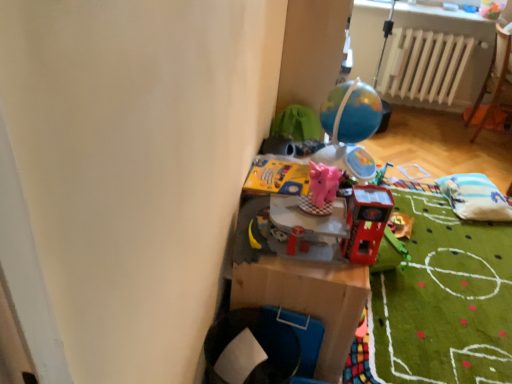
Identify the location of shiny metallic globe at upper center, the 4th toy positioned from the front. This screenshot has height=384, width=512. (350, 128).

The image size is (512, 384). Describe the element at coordinates (475, 197) in the screenshot. I see `white fabric bean bag at right` at that location.

What is the approximate width of white fabric bean bag at right?

It is 14.12 inches.

In order to face pink rubber elephant at center, the 3th toy in the back-to-front sequence, should I rotate leftwards or rightwards?

It's best to rotate right around 8.868 degrees.

The height and width of the screenshot is (384, 512). I want to click on wooden chair at right, so click(495, 81).

The width and height of the screenshot is (512, 384). What do you see at coordinates (366, 222) in the screenshot? I see `metallic red dartboard at center, the 4th toy positioned from the back` at bounding box center [366, 222].

Locate an element on the screen. shiny metallic globe at upper center, arranged as the first toy when viewed from the back is located at coordinates (350, 128).

Which is more to the right, shiny metallic globe at upper center, the 4th toy positioned from the front, or white matte radiator at upper right?

white matte radiator at upper right.

Considering the relative sizes of shiny metallic globe at upper center, the 4th toy positioned from the front, and white matte radiator at upper right in the image provided, is shiny metallic globe at upper center, the 4th toy positioned from the front, bigger than white matte radiator at upper right?

No, shiny metallic globe at upper center, the 4th toy positioned from the front, is not bigger than white matte radiator at upper right.

Is white matte radiator at upper right inside shiny metallic globe at upper center, the 4th toy positioned from the front?

No, white matte radiator at upper right is not inside shiny metallic globe at upper center, the 4th toy positioned from the front.

Considering the relative sizes of white matte radiator at upper right and shiny metallic globe at upper center, the 4th toy positioned from the front, in the image provided, is white matte radiator at upper right shorter than shiny metallic globe at upper center, the 4th toy positioned from the front,?

No, white matte radiator at upper right is not shorter than shiny metallic globe at upper center, the 4th toy positioned from the front.

From the image's perspective, which one is positioned lower, white matte radiator at upper right or shiny metallic globe at upper center, the 4th toy positioned from the front?

shiny metallic globe at upper center, the 4th toy positioned from the front, appears lower in the image.

Which is closer to the camera, (x=443, y=62) or (x=338, y=119)?

Point (x=443, y=62) is positioned farther from the camera compared to point (x=338, y=119).

From a real-world perspective, who is located higher, white matte radiator at upper right or shiny metallic globe at upper center, the 4th toy positioned from the front?

From a 3D spatial view, shiny metallic globe at upper center, the 4th toy positioned from the front, is above.

Between shiny metallic globe at upper center, the 4th toy positioned from the front, and metallic red dartboard at center, the 4th toy positioned from the back, which one appears on the right side from the viewer's perspective?

shiny metallic globe at upper center, the 4th toy positioned from the front.

Does shiny metallic globe at upper center, the 4th toy positioned from the front, lie behind metallic red dartboard at center, the 1th toy when ordered from front to back?

Yes, shiny metallic globe at upper center, the 4th toy positioned from the front, is behind metallic red dartboard at center, the 1th toy when ordered from front to back.

Which of these two, shiny metallic globe at upper center, the 4th toy positioned from the front, or metallic red dartboard at center, the 4th toy positioned from the back, is wider?

Wider between the two is shiny metallic globe at upper center, the 4th toy positioned from the front.

Can you see shiny metallic globe at upper center, arranged as the first toy when viewed from the back, touching metallic red dartboard at center, the 1th toy when ordered from front to back?

No, shiny metallic globe at upper center, arranged as the first toy when viewed from the back, is not making contact with metallic red dartboard at center, the 1th toy when ordered from front to back.

Which is less distant, (457, 213) or (359, 160)?

Clearly, point (457, 213) is more distant from the camera than point (359, 160).

Based on the photo, from a real-world perspective, which is physically above, white fabric bean bag at right or shiny metallic globe at upper center, arranged as the first toy when viewed from the back?

In real-world perspective, shiny metallic globe at upper center, arranged as the first toy when viewed from the back, is above.

Which object is closer to the camera taking this photo, white fabric bean bag at right or shiny metallic globe at upper center, arranged as the first toy when viewed from the back?

shiny metallic globe at upper center, arranged as the first toy when viewed from the back, is more forward.

Consider the image. Are white fabric bean bag at right and shiny metallic globe at upper center, the 4th toy positioned from the front, making contact?

They are not placed beside each other.

How distant is wooden chair at right from white fabric bean bag at right?

The distance of wooden chair at right from white fabric bean bag at right is 3.34 feet.

Would you say wooden chair at right is a long distance from white fabric bean bag at right?

Indeed, wooden chair at right is not near white fabric bean bag at right.

In the scene shown: Can we say wooden chair at right lies outside white fabric bean bag at right?

Yes, wooden chair at right is outside of white fabric bean bag at right.

This screenshot has width=512, height=384. I want to click on furniture above the white fabric bean bag at right (from a real-world perspective), so click(x=495, y=81).

How far apart are yellow cardboard book at center, marked as the 3th toy in a front-to-back arrangement, and metallic red dartboard at center, the 4th toy positioned from the back?

The distance of yellow cardboard book at center, marked as the 3th toy in a front-to-back arrangement, from metallic red dartboard at center, the 4th toy positioned from the back, is 12.97 inches.

Is yellow cardboard book at center, marked as the 3th toy in a front-to-back arrangement, bigger or smaller than metallic red dartboard at center, the 1th toy when ordered from front to back?

In the image, yellow cardboard book at center, marked as the 3th toy in a front-to-back arrangement, appears to be smaller than metallic red dartboard at center, the 1th toy when ordered from front to back.

Could you tell me if yellow cardboard book at center, positioned as the 2th toy in back-to-front order, is turned towards metallic red dartboard at center, the 4th toy positioned from the back?

No, yellow cardboard book at center, positioned as the 2th toy in back-to-front order, is not turned towards metallic red dartboard at center, the 4th toy positioned from the back.

Can you tell me how much yellow cardboard book at center, marked as the 3th toy in a front-to-back arrangement, and metallic red dartboard at center, the 1th toy when ordered from front to back, differ in facing direction?

The angle between the facing direction of yellow cardboard book at center, marked as the 3th toy in a front-to-back arrangement, and the facing direction of metallic red dartboard at center, the 1th toy when ordered from front to back, is 9.46 degrees.

Would you consider metallic red dartboard at center, the 1th toy when ordered from front to back, to be distant from white fabric bean bag at right?

Absolutely, metallic red dartboard at center, the 1th toy when ordered from front to back, is distant from white fabric bean bag at right.

Is point (367, 215) closer or farther from the camera than point (439, 181)?

Point (367, 215) appears to be closer to the viewer than point (439, 181).

Does metallic red dartboard at center, the 4th toy positioned from the back, come in front of white fabric bean bag at right?

That is True.

Choose the correct answer: Is metallic red dartboard at center, the 4th toy positioned from the back, inside white fabric bean bag at right or outside it?

metallic red dartboard at center, the 4th toy positioned from the back, lies outside white fabric bean bag at right.

In order to click on radiator on the right side of shiny metallic globe at upper center, the 4th toy positioned from the front in this screenshot , I will do `click(426, 65)`.

Locate an element on the screen. radiator above the shiny metallic globe at upper center, arranged as the first toy when viewed from the back (from the image's perspective) is located at coordinates (426, 65).

Looking at the image, which one is located further to pink rubber elephant at center, the 3th toy in the back-to-front sequence, white matte radiator at upper right or metallic red dartboard at center, the 1th toy when ordered from front to back?

white matte radiator at upper right is positioned further to the anchor pink rubber elephant at center, the 3th toy in the back-to-front sequence.

From the picture: Which object lies nearer to the anchor point white fabric bean bag at right, wooden chair at right or pink rubber elephant at center, which appears as the 2th toy when viewed from the front?

wooden chair at right lies closer to white fabric bean bag at right than the other object.

Estimate the real-world distances between objects in this image. Which object is further from white fabric bean bag at right, shiny metallic globe at upper center, the 4th toy positioned from the front, or yellow cardboard book at center, marked as the 3th toy in a front-to-back arrangement?

yellow cardboard book at center, marked as the 3th toy in a front-to-back arrangement.

Which object lies nearer to the anchor point shiny metallic globe at upper center, the 4th toy positioned from the front, pink rubber elephant at center, which appears as the 2th toy when viewed from the front, or wooden chair at right?

Based on the image, pink rubber elephant at center, which appears as the 2th toy when viewed from the front, appears to be nearer to shiny metallic globe at upper center, the 4th toy positioned from the front.

Looking at the image, which one is located further to shiny metallic globe at upper center, the 4th toy positioned from the front, white matte radiator at upper right or wooden chair at right?

wooden chair at right is positioned further to the anchor shiny metallic globe at upper center, the 4th toy positioned from the front.

Based on their spatial positions, is metallic red dartboard at center, the 1th toy when ordered from front to back, or white fabric bean bag at right further from wooden chair at right?

Based on the image, metallic red dartboard at center, the 1th toy when ordered from front to back, appears to be further to wooden chair at right.

Based on their spatial positions, is shiny metallic globe at upper center, the 4th toy positioned from the front, or white fabric bean bag at right closer to pink rubber elephant at center, the 3th toy in the back-to-front sequence?

shiny metallic globe at upper center, the 4th toy positioned from the front, is positioned closer to the anchor pink rubber elephant at center, the 3th toy in the back-to-front sequence.

Estimate the real-world distances between objects in this image. Which object is closer to white fabric bean bag at right, pink rubber elephant at center, which appears as the 2th toy when viewed from the front, or white matte radiator at upper right?

white matte radiator at upper right lies closer to white fabric bean bag at right than the other object.

What are the coordinates of `furniture between shiny metallic globe at upper center, arranged as the first toy when viewed from the back, and white matte radiator at upper right in the front-back direction` in the screenshot? It's located at (495, 81).

Where is `furniture between white matte radiator at upper right and white fabric bean bag at right from top to bottom`? Image resolution: width=512 pixels, height=384 pixels. furniture between white matte radiator at upper right and white fabric bean bag at right from top to bottom is located at coordinates (495, 81).

You are a GUI agent. You are given a task and a screenshot of the screen. Output one action in this format:
    pyautogui.click(x=<x>, y=<y>)
    Task: Click on the bean bag chair situated between pink rubber elephant at center, the 3th toy in the back-to-front sequence, and wooden chair at right from left to right
    The image size is (512, 384).
    Given the screenshot: What is the action you would take?
    pyautogui.click(x=475, y=197)

I want to click on furniture located between pink rubber elephant at center, which appears as the 2th toy when viewed from the front, and white matte radiator at upper right in the depth direction, so click(495, 81).